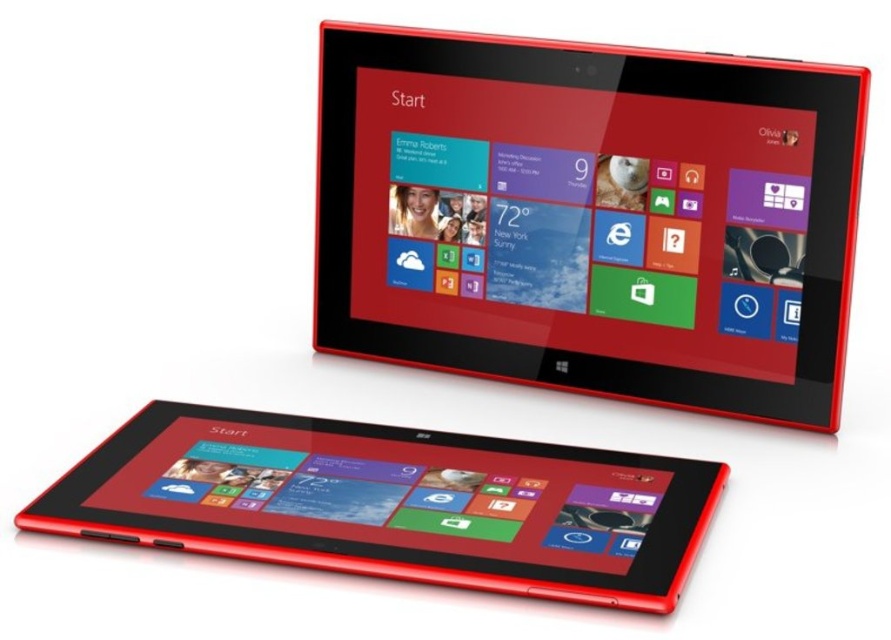
Who is positioned more to the left, matte plastic tablet at upper center or matte black tablet at lower left?

Positioned to the left is matte black tablet at lower left.

Between matte plastic tablet at upper center and matte black tablet at lower left, which one is positioned higher?

matte plastic tablet at upper center

Is point (815, 385) less distant than point (285, 436)?

No, (815, 385) is further to viewer.

Where is `matte plastic tablet at upper center`? The width and height of the screenshot is (891, 640). matte plastic tablet at upper center is located at coordinates (595, 214).